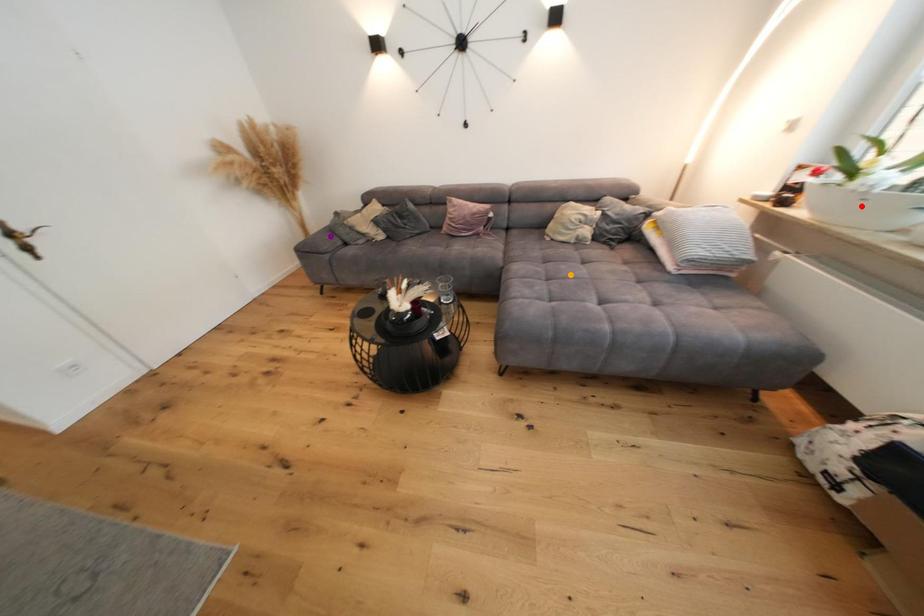
Order these from nearest to farthest:
A) red point
B) orange point
C) purple point

red point → orange point → purple point